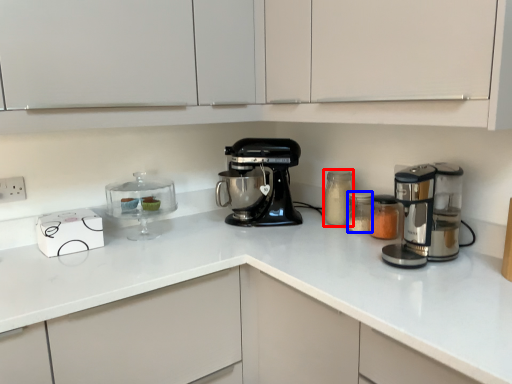
Question: Which object is further to the camera taking this photo, bottle (highlighted by a red box) or appliance (highlighted by a blue box)?

Choices:
 (A) bottle
 (B) appliance

Answer: (A)